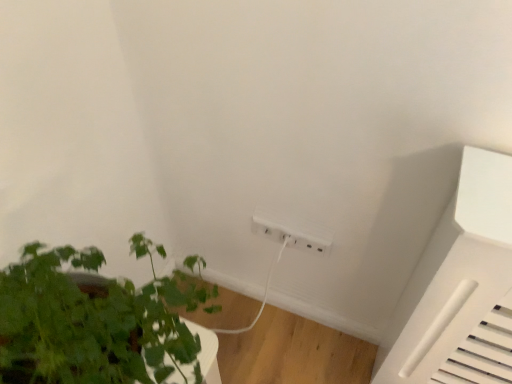
This screenshot has width=512, height=384. I want to click on white plastic power outlet at lower center, so click(x=292, y=232).

What do you see at coordinates (292, 232) in the screenshot? I see `white plastic power outlet at lower center` at bounding box center [292, 232].

The image size is (512, 384). I want to click on white plastic power outlet at lower center, so click(292, 232).